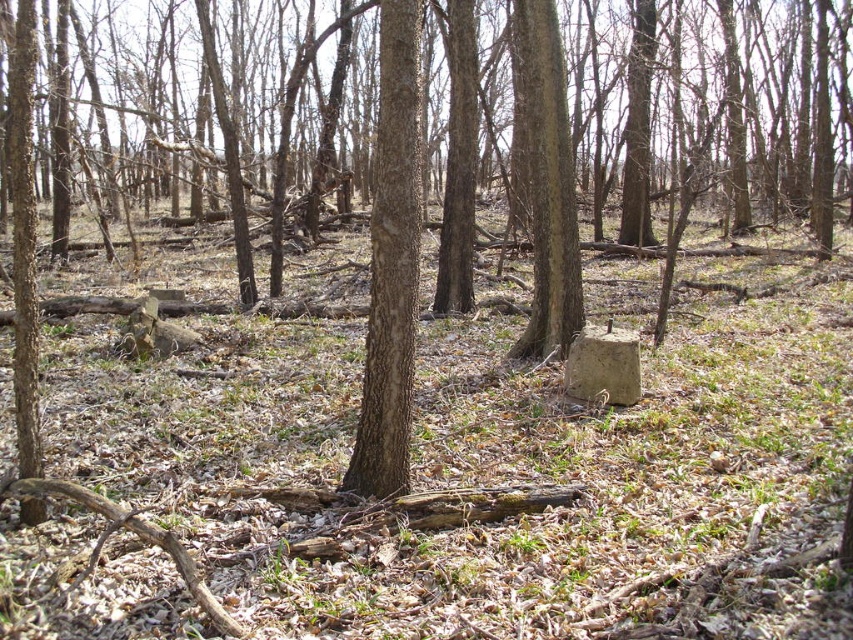
Between rough bark tree at center and brown rough bark tree at lower left, which one is positioned lower?

rough bark tree at center is below.

Does point (560, 108) lie in front of point (28, 134)?

That is False.

Who is more distant from viewer, (566, 326) or (9, 115)?

The point (9, 115) is more distant.

What are the coordinates of `rough bark tree at center` in the screenshot? It's located at (548, 186).

How far apart are brown rough bark tree trunk at center and rough bark tree at center?

brown rough bark tree trunk at center is 3.39 meters away from rough bark tree at center.

Does brown rough bark tree trunk at center have a larger size compared to rough bark tree at center?

Actually, brown rough bark tree trunk at center might be smaller than rough bark tree at center.

Between point (403, 380) and point (532, 257), which one is positioned behind?

The point (532, 257) is more distant.

Locate an element on the screen. The image size is (853, 640). brown rough bark tree trunk at center is located at coordinates (390, 266).

Between point (376, 193) and point (20, 4), which one is positioned behind?

The point (376, 193) is more distant.

What are the coordinates of `brown rough bark tree trunk at center` in the screenshot? It's located at (390, 266).

Is point (392, 406) behind point (26, 358)?

Yes, point (392, 406) is behind point (26, 358).

Image resolution: width=853 pixels, height=640 pixels. I want to click on brown rough bark tree trunk at center, so click(390, 266).